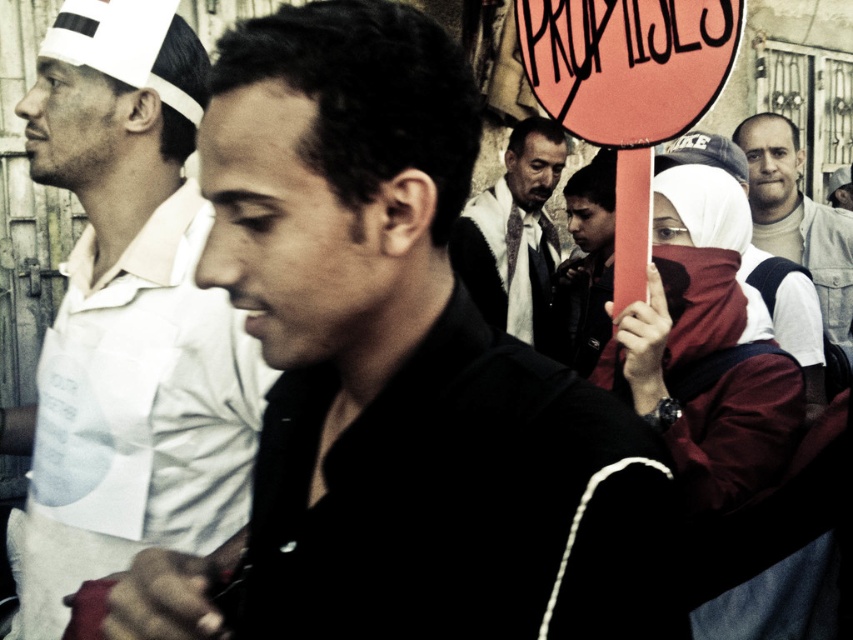
From the picture: Measure the distance between black matte shirt at center and white cotton shirt at left.

A distance of 4.94 meters exists between black matte shirt at center and white cotton shirt at left.

Is point (525, 499) farther from camera compared to point (105, 531)?

No, it is in front of (105, 531).

Is point (576, 634) positioned in front of point (59, 403)?

That is True.

You are a GUI agent. You are given a task and a screenshot of the screen. Output one action in this format:
    pyautogui.click(x=<x>, y=<y>)
    Task: Click on the black matte shirt at center
    
    Given the screenshot: What is the action you would take?
    pyautogui.click(x=404, y=362)

Between black matte shirt at center and dark brown leather jacket at center, which one appears on the right side from the viewer's perspective?

dark brown leather jacket at center

Locate an element on the screen. This screenshot has height=640, width=853. black matte shirt at center is located at coordinates (404, 362).

Which is more to the right, black matte shirt at center or matte red scarf at center?

matte red scarf at center

Can you confirm if black matte shirt at center is smaller than matte red scarf at center?

No.

Is point (444, 406) positioned in front of point (709, 273)?

Yes, point (444, 406) is in front of point (709, 273).

Identify the location of black matte shirt at center. This screenshot has height=640, width=853. (404, 362).